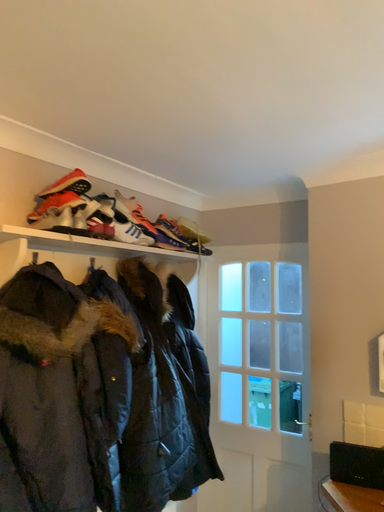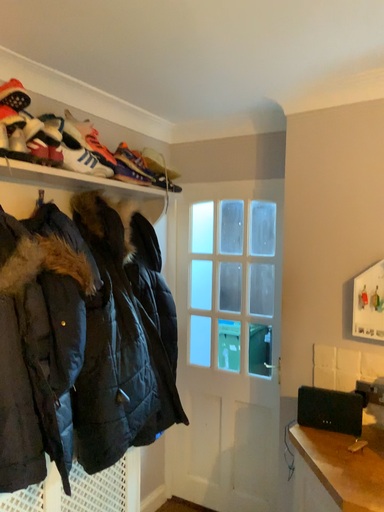
Question: How did the camera likely rotate when shooting the video?

Choices:
 (A) rotated downward
 (B) rotated upward

Answer: (A)